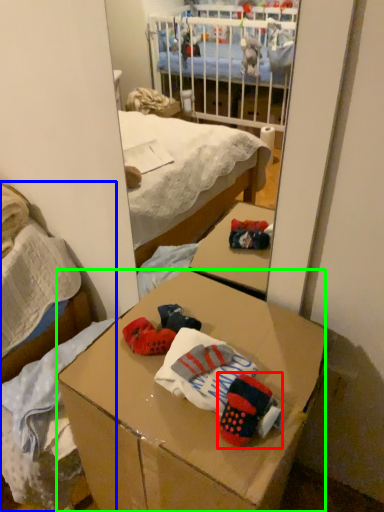
Question: Which is farther away from toy (highlighted by a red box)? bed (highlighted by a blue box) or desk (highlighted by a green box)?

Choices:
 (A) bed
 (B) desk

Answer: (A)